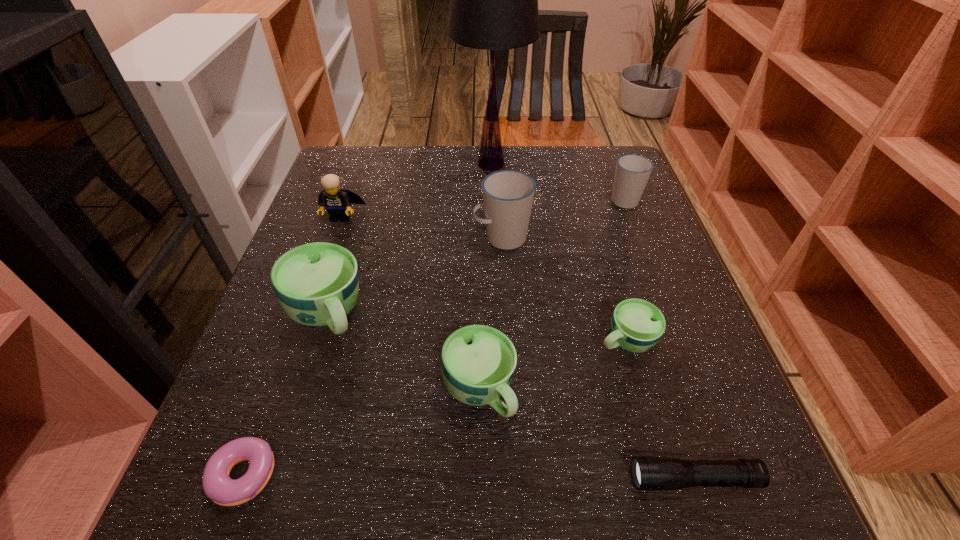
Where is `object at the near left corner`? The width and height of the screenshot is (960, 540). object at the near left corner is located at coordinates (218, 486).

Where is `object present at the far right corner`? The image size is (960, 540). object present at the far right corner is located at coordinates (632, 172).

Identify the location of object present at the near right corner. Image resolution: width=960 pixels, height=540 pixels. (649, 473).

Where is `free region at the far edge of the desktop`? Image resolution: width=960 pixels, height=540 pixels. free region at the far edge of the desktop is located at coordinates (475, 164).

In the image, there is a desktop. At what (x,y) coordinates should I click in order to perform the action: click on vacant space at the near edge. Please return your answer as a coordinate pair (x, y). The height and width of the screenshot is (540, 960). Looking at the image, I should click on (563, 517).

In the image, there is a desktop. Where is `free space at the left edge`? The width and height of the screenshot is (960, 540). free space at the left edge is located at coordinates (346, 233).

The height and width of the screenshot is (540, 960). In order to click on vacant space at the right edge of the desktop in this screenshot , I will do `click(642, 434)`.

Identify the location of free space at the near left corner of the desktop. The height and width of the screenshot is (540, 960). (209, 521).

In order to click on vacant space at the far right corner in this screenshot , I will do `click(577, 165)`.

In the image, there is a desktop. Where is `free space at the near right corner`? Image resolution: width=960 pixels, height=540 pixels. free space at the near right corner is located at coordinates (770, 494).